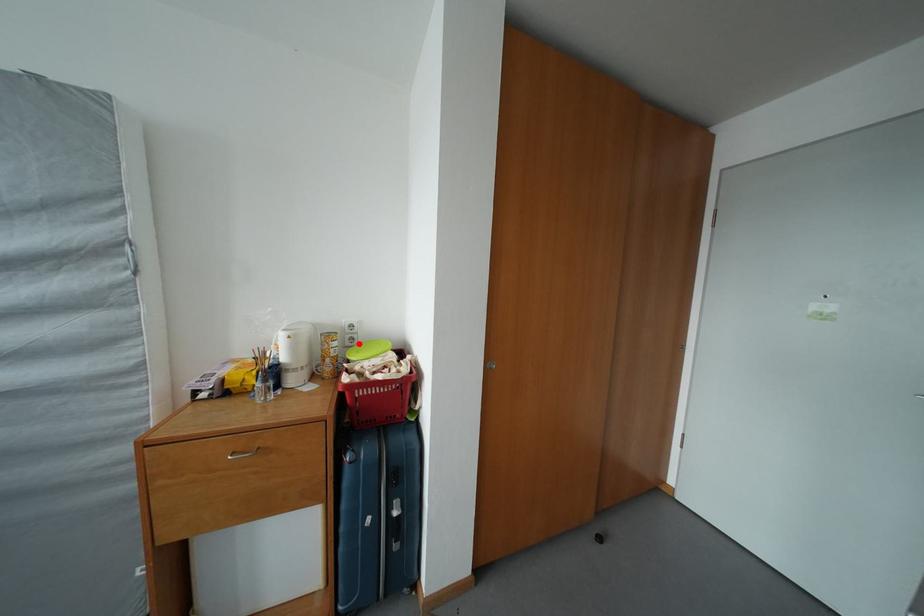
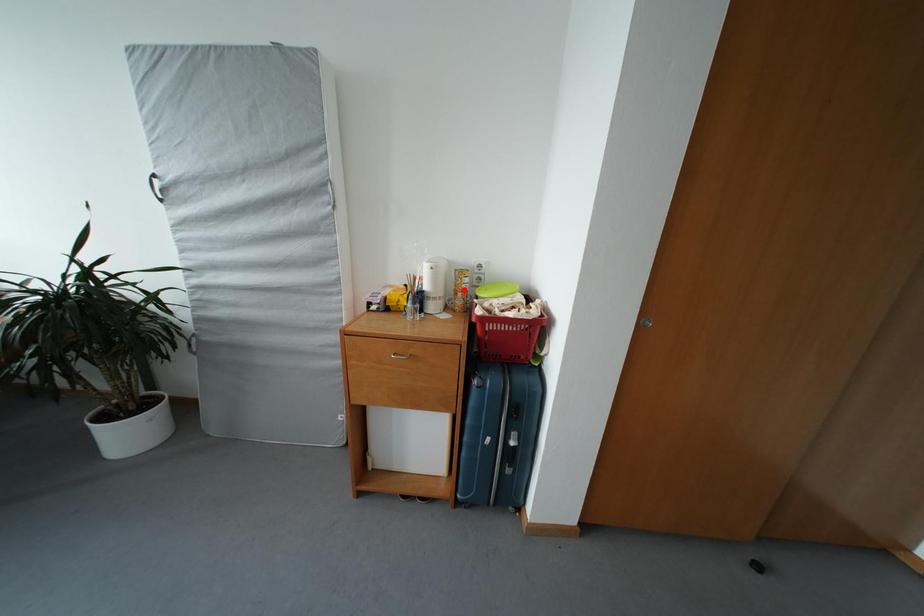
I am providing you with two images of the same scene from different viewpoints. A red point is marked on the first image and another point is marked on the second image. Do the highlighted points in image1 and image2 indicate the same real-world spot?

No